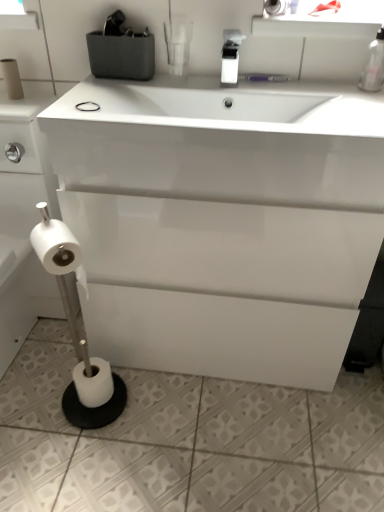
In order to click on free spot to the right of white matte toilet paper at left, which is counted as the 2th toilet paper, starting from the top in this screenshot , I will do `click(37, 98)`.